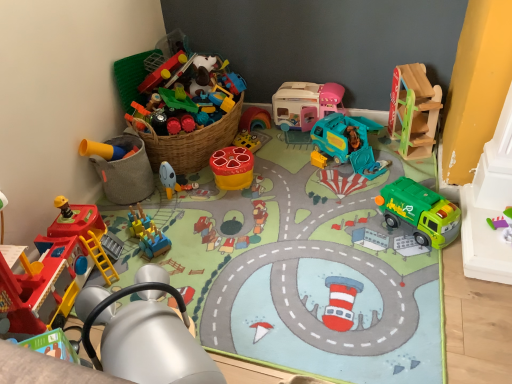
Locate an element on the screen. The image size is (512, 384). vacant area that is in front of matte plastic stool at center, the 5th toy from the right is located at coordinates (236, 203).